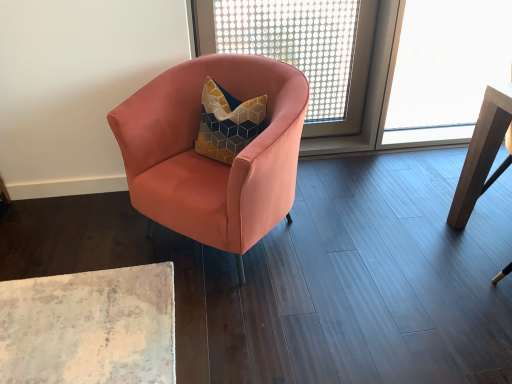
I want to click on matte pink armchair at center, so click(x=211, y=159).

Locate an element on the screen. The width and height of the screenshot is (512, 384). matte pink armchair at center is located at coordinates (211, 159).

Which is more to the right, wooden table at right or matte pink armchair at center?

wooden table at right is more to the right.

Is wooden table at right positioned with its back to matte pink armchair at center?

wooden table at right is not turned away from matte pink armchair at center.

In terms of width, does wooden table at right look wider or thinner when compared to matte pink armchair at center?

wooden table at right is thinner than matte pink armchair at center.

From a real-world perspective, is wooden table at right beneath matte pink armchair at center?

No.

Can you tell me how much matte pink armchair at center and wooden table at right differ in facing direction?

44.3 degrees separate the facing orientations of matte pink armchair at center and wooden table at right.

From a real-world perspective, does matte pink armchair at center stand above wooden table at right?

Actually, matte pink armchair at center is physically below wooden table at right in the real world.

Based on their sizes in the image, would you say matte pink armchair at center is bigger or smaller than wooden table at right?

Considering their sizes, matte pink armchair at center takes up more space than wooden table at right.

Could you tell me if matte pink armchair at center is facing wooden table at right?

No, matte pink armchair at center is not facing towards wooden table at right.

Is wooden table at right positioned behind transparent plastic screen at upper center?

No, it is in front of transparent plastic screen at upper center.

From the picture: Is wooden table at right next to transparent plastic screen at upper center and touching it?

wooden table at right and transparent plastic screen at upper center are not in contact.

How different are the orientations of wooden table at right and transparent plastic screen at upper center in degrees?

There is a 1.2-degree angle between the facing directions of wooden table at right and transparent plastic screen at upper center.

In the scene shown: Is wooden table at right oriented away from transparent plastic screen at upper center?

No.

From the image's perspective, does transparent plastic screen at upper center appear higher than wooden table at right?

Correct, transparent plastic screen at upper center appears higher than wooden table at right in the image.

In the scene shown: Is transparent plastic screen at upper center touching wooden table at right?

No, transparent plastic screen at upper center is not with wooden table at right.

Consider the image. Is transparent plastic screen at upper center spatially inside wooden table at right, or outside of it?

transparent plastic screen at upper center is spatially situated outside wooden table at right.

Looking at this image, between transparent plastic screen at upper center and wooden table at right, which one has smaller width?

transparent plastic screen at upper center.

Is matte pink armchair at center at the left side of transparent plastic screen at upper center?

Yes, matte pink armchair at center is to the left of transparent plastic screen at upper center.

Who is taller, matte pink armchair at center or transparent plastic screen at upper center?

With more height is transparent plastic screen at upper center.

Is matte pink armchair at center positioned behind transparent plastic screen at upper center?

No, matte pink armchair at center is closer to the camera.

Does point (230, 216) appear closer or farther from the camera than point (298, 20)?

Point (230, 216) is positioned closer to the camera compared to point (298, 20).

From the image's perspective, is transparent plastic screen at upper center located above or below matte pink armchair at center?

From the image's perspective, transparent plastic screen at upper center appears above matte pink armchair at center.

Who is more distant, transparent plastic screen at upper center or matte pink armchair at center?

transparent plastic screen at upper center is more distant.

In the image, is transparent plastic screen at upper center on the left side or the right side of matte pink armchair at center?

transparent plastic screen at upper center is to the right of matte pink armchair at center.

Is matte pink armchair at center at the back of transparent plastic screen at upper center?

transparent plastic screen at upper center is not turned away from matte pink armchair at center.

Locate an element on the screen. The height and width of the screenshot is (384, 512). chair below the wooden table at right (from the image's perspective) is located at coordinates (211, 159).

The width and height of the screenshot is (512, 384). What are the coordinates of `table behind the matte pink armchair at center` in the screenshot? It's located at (481, 152).

Which object lies further to the anchor point matte pink armchair at center, transparent plastic screen at upper center or wooden table at right?

transparent plastic screen at upper center is further to matte pink armchair at center.

Which object lies further to the anchor point matte pink armchair at center, wooden table at right or transparent plastic screen at upper center?

transparent plastic screen at upper center.

Based on their spatial positions, is transparent plastic screen at upper center or matte pink armchair at center further from wooden table at right?

transparent plastic screen at upper center lies further to wooden table at right than the other object.

Looking at the image, which one is located further to transparent plastic screen at upper center, wooden table at right or matte pink armchair at center?

Based on the image, wooden table at right appears to be further to transparent plastic screen at upper center.

Based on their spatial positions, is matte pink armchair at center or wooden table at right further from transparent plastic screen at upper center?

wooden table at right is further to transparent plastic screen at upper center.

Considering their positions, is matte pink armchair at center positioned closer to wooden table at right than transparent plastic screen at upper center?

Among the two, matte pink armchair at center is located nearer to wooden table at right.

Find the location of a particular element. window screen between matte pink armchair at center and wooden table at right in the horizontal direction is located at coordinates (297, 43).